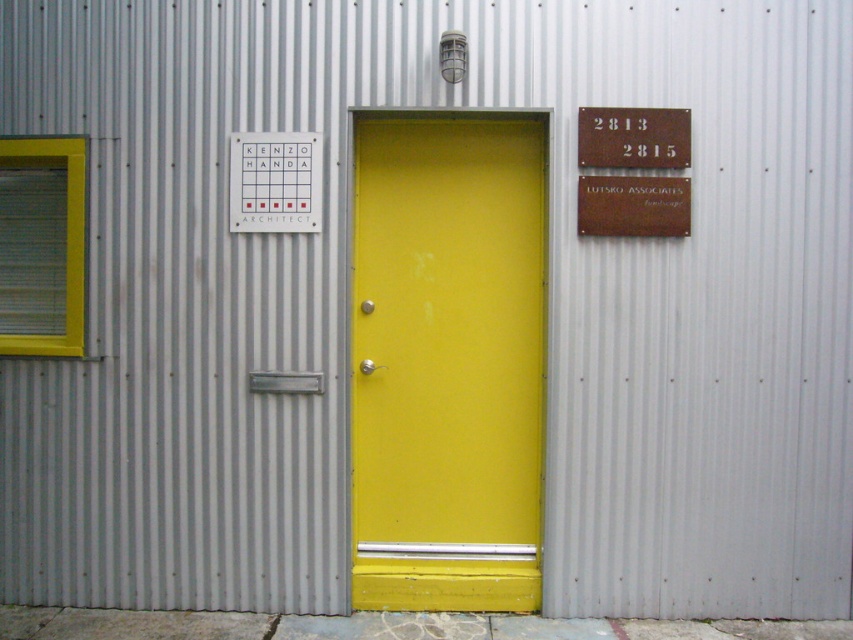
You are standing in front of the building and notice two points marked on the wall. The first point is at coordinates point (659, 124) and the second is at point (595, 228). From your perspective, which point is closer to you?

Point (595, 228) is closer to you because it is in front of point (659, 124).